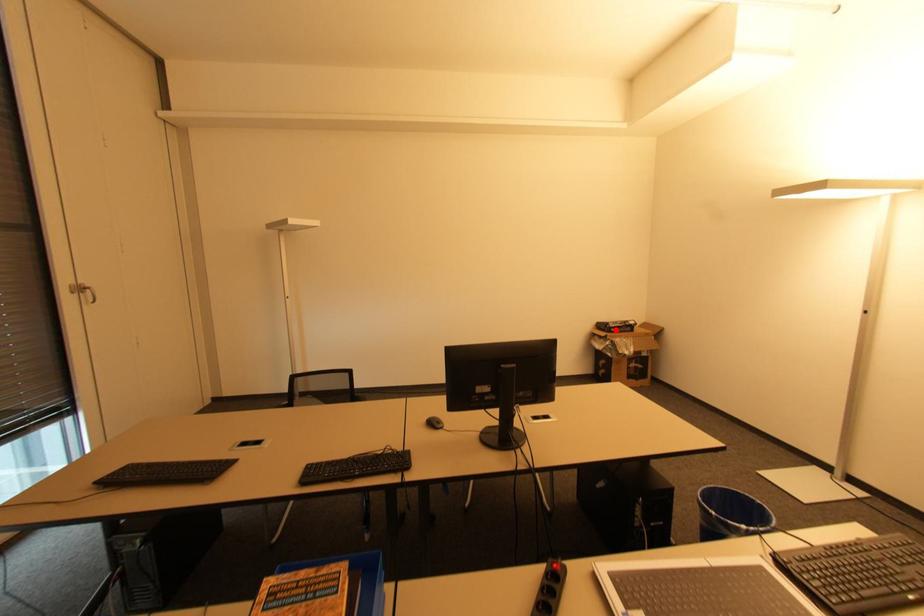
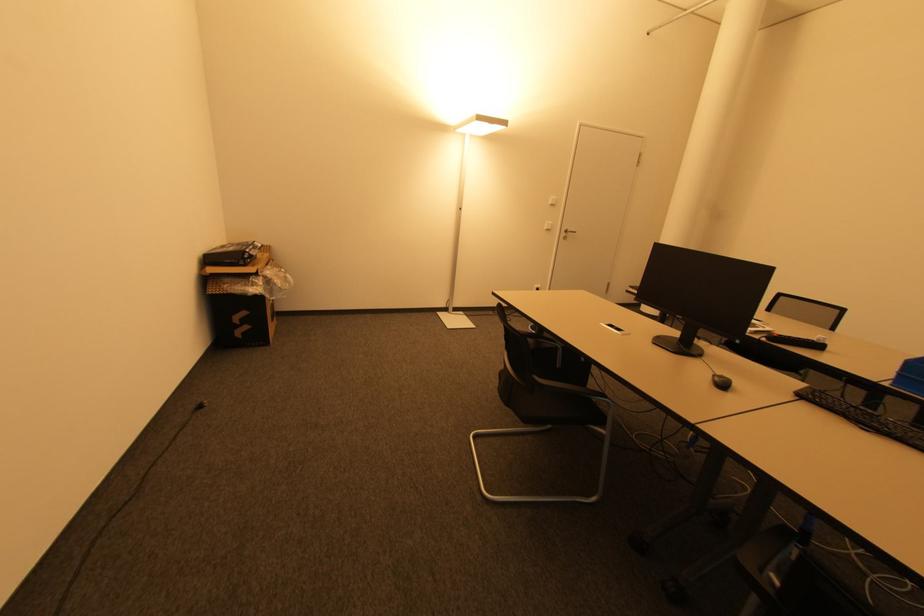
Find the pixel in the second image that matches the highlighted location in the first image.

(250, 261)